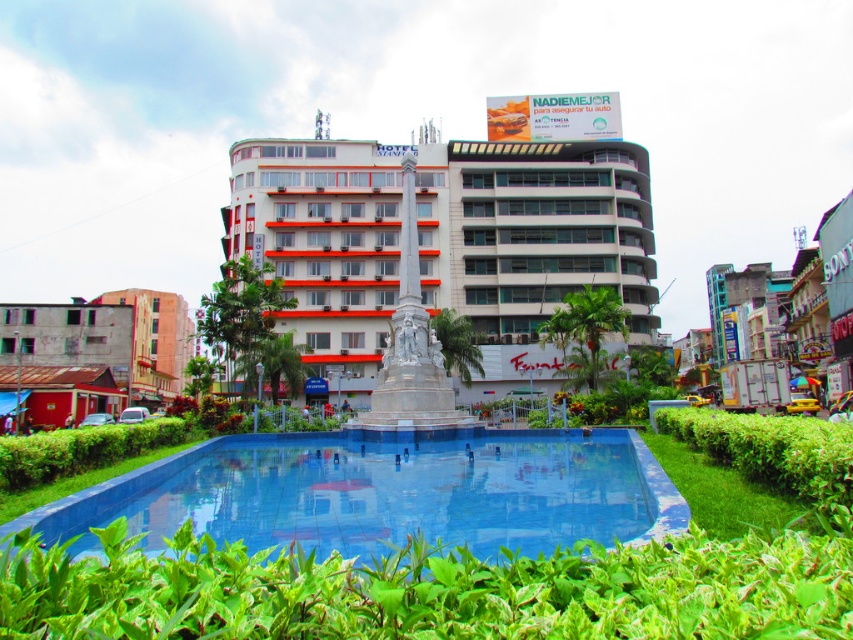
Question: Is white glossy building at center in front of blue tile pool at center?

Choices:
 (A) yes
 (B) no

Answer: (B)

Question: Which object is closer to the camera taking this photo?

Choices:
 (A) white glossy building at center
 (B) rusty metal building at left
 (C) blue tile pool at center

Answer: (C)

Question: Considering the relative positions of blue tile pool at center and rusty metal building at left in the image provided, where is blue tile pool at center located with respect to rusty metal building at left?

Choices:
 (A) above
 (B) below

Answer: (B)

Question: Among these points, which one is farthest from the camera?

Choices:
 (A) click(508, 163)
 (B) click(331, 456)
 (C) click(4, 321)

Answer: (A)

Question: Which object is closer to the camera taking this photo?

Choices:
 (A) white glossy building at center
 (B) rusty metal building at left
 (C) blue tile pool at center

Answer: (C)

Question: Observing the image, what is the correct spatial positioning of white glossy building at center in reference to blue tile pool at center?

Choices:
 (A) right
 (B) left

Answer: (A)